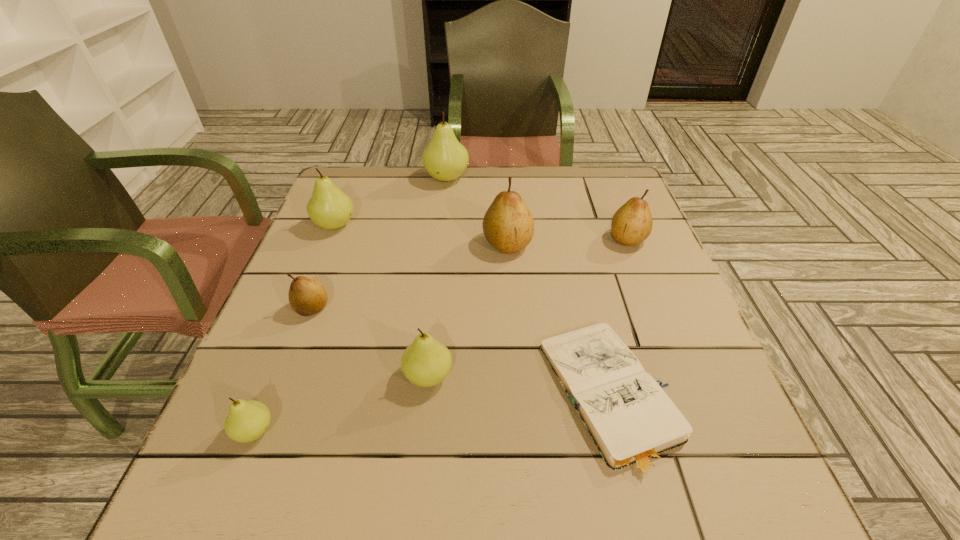
This screenshot has height=540, width=960. Identify the location of the biggest green pear. (444, 158).

Identify the location of the tallest object. The height and width of the screenshot is (540, 960). (444, 158).

You are a GUI agent. You are given a task and a screenshot of the screen. Output one action in this format:
    pyautogui.click(x=<x>, y=<y>)
    Task: Click on the third nearest green pear
    The image size is (960, 540).
    Given the screenshot: What is the action you would take?
    pyautogui.click(x=329, y=208)

I want to click on the second brown pear from left to right, so click(508, 225).

Identify the location of the biggest brown pear. (508, 225).

Find the location of a particular element. This screenshot has width=960, height=540. the third farthest green pear is located at coordinates (426, 362).

Find the location of a particular element. Image resolution: width=960 pixels, height=540 pixels. the third biggest green pear is located at coordinates (x=426, y=362).

Where is `the second biggest brown pear`? Image resolution: width=960 pixels, height=540 pixels. the second biggest brown pear is located at coordinates (632, 223).

This screenshot has width=960, height=540. I want to click on the rightmost pear, so click(x=632, y=223).

Find the location of `the smallest brown pear`. the smallest brown pear is located at coordinates (307, 296).